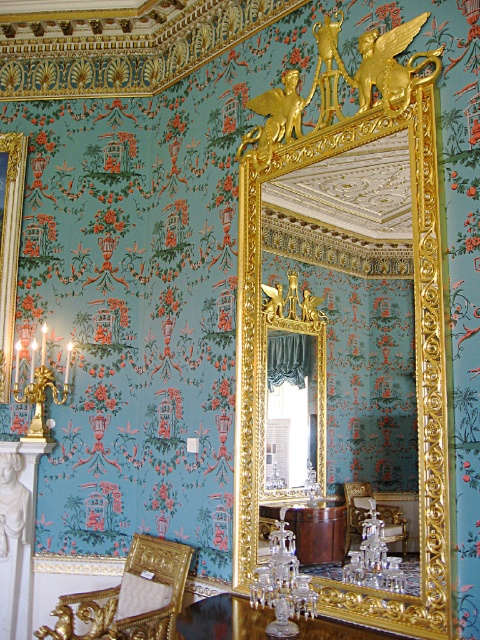
Is gold metallic chandelier at left taller than gold leaf chair at center?

Yes.

Between point (68, 358) and point (357, 496), which one is positioned in front?

Point (357, 496) is more forward.

This screenshot has width=480, height=640. Find the location of `gold metallic chandelier at left`. gold metallic chandelier at left is located at coordinates (39, 385).

Which is more to the right, gold upholstered chair at lower left or gold leaf chair at center?

gold leaf chair at center

Who is taller, gold upholstered chair at lower left or gold leaf chair at center?

With more height is gold upholstered chair at lower left.

Is point (177, 561) in front of point (397, 525)?

No, (177, 561) is behind (397, 525).

Identify the location of gold upholstered chair at lower left. (130, 596).

Who is lower down, goldmaterial/texturemirror at upper center or gold metallic chandelier at left?

Positioned lower is gold metallic chandelier at left.

Does goldmaterial/texturemirror at upper center appear on the left side of gold metallic chandelier at left?

No, goldmaterial/texturemirror at upper center is not to the left of gold metallic chandelier at left.

Find the location of `goldmaterial/texturemirror at upper center`. goldmaterial/texturemirror at upper center is located at coordinates point(346,308).

The width and height of the screenshot is (480, 640). In order to click on goldmaterial/texturemirror at upper center in this screenshot , I will do `click(346, 308)`.